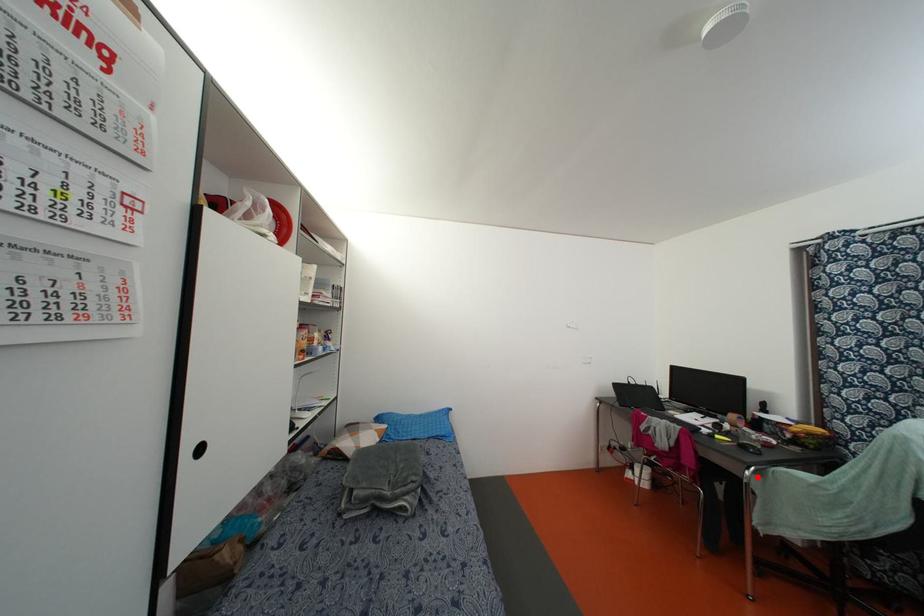
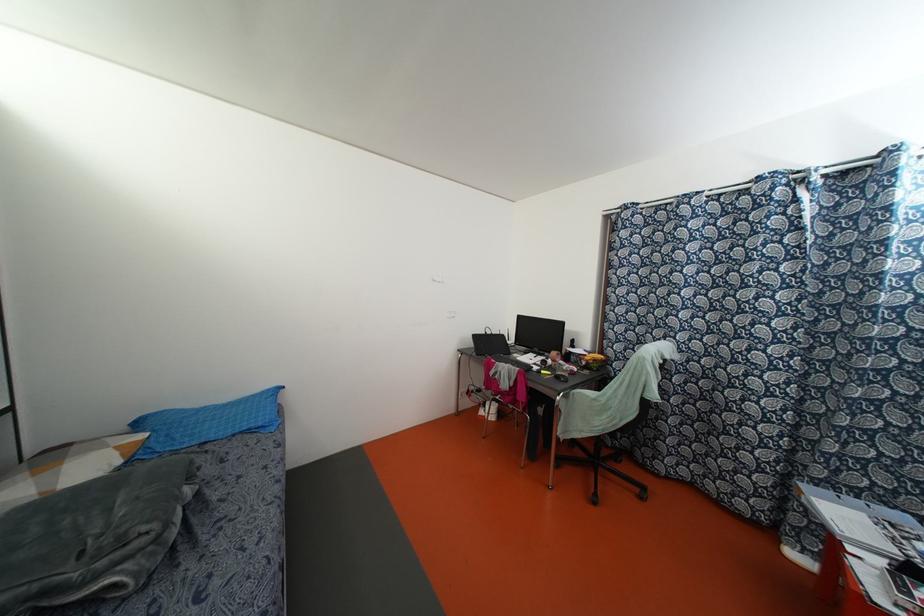
Question: A red point is marked in image1. In image2, is the corresponding 3D point closer to the camera or farther? Reply with the corresponding letter.

Choices:
 (A) The corresponding 3D point is closer.
 (B) The corresponding 3D point is farther.

Answer: (A)